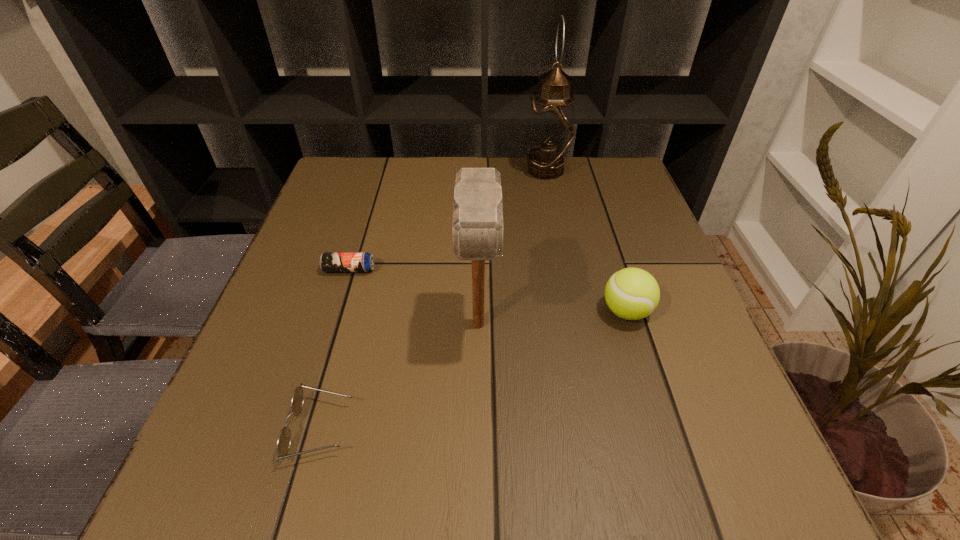
Where is `vacant space at the left edge`? vacant space at the left edge is located at coordinates (314, 325).

You are a GUI agent. You are given a task and a screenshot of the screen. Output one action in this format:
    pyautogui.click(x=<x>, y=<y>)
    Task: Click on the vacant space at the right edge of the desktop
    This screenshot has height=540, width=960.
    Given the screenshot: What is the action you would take?
    pyautogui.click(x=693, y=433)

This screenshot has height=540, width=960. In order to click on free space at the far left corner of the desktop in this screenshot , I will do click(328, 204).

In the image, there is a desktop. At what (x,y) coordinates should I click in order to perform the action: click on free space at the near left corner. Please return your answer as a coordinate pair (x, y). The width and height of the screenshot is (960, 540). Looking at the image, I should click on (292, 464).

Find the location of `free space at the far right corner`. free space at the far right corner is located at coordinates (607, 171).

Find the location of a particular element. This screenshot has height=540, width=960. empty location between the third tallest object and the farthest object is located at coordinates (586, 241).

Locate an element on the screen. The height and width of the screenshot is (540, 960). free space between the second tallest object and the nearest object is located at coordinates (399, 376).

This screenshot has width=960, height=540. I want to click on free space between the fourth nearest object and the oil lamp, so coord(447,220).

You are a GUI agent. You are given a task and a screenshot of the screen. Output one action in this format:
    pyautogui.click(x=<x>, y=<y>)
    Task: Click on the vacant area that lies between the third shortest object and the tallest object
    This screenshot has height=540, width=960.
    Given the screenshot: What is the action you would take?
    pyautogui.click(x=586, y=241)

Locate an element on the screen. This screenshot has height=540, width=960. vacant area between the spectacles and the beer can is located at coordinates (335, 349).